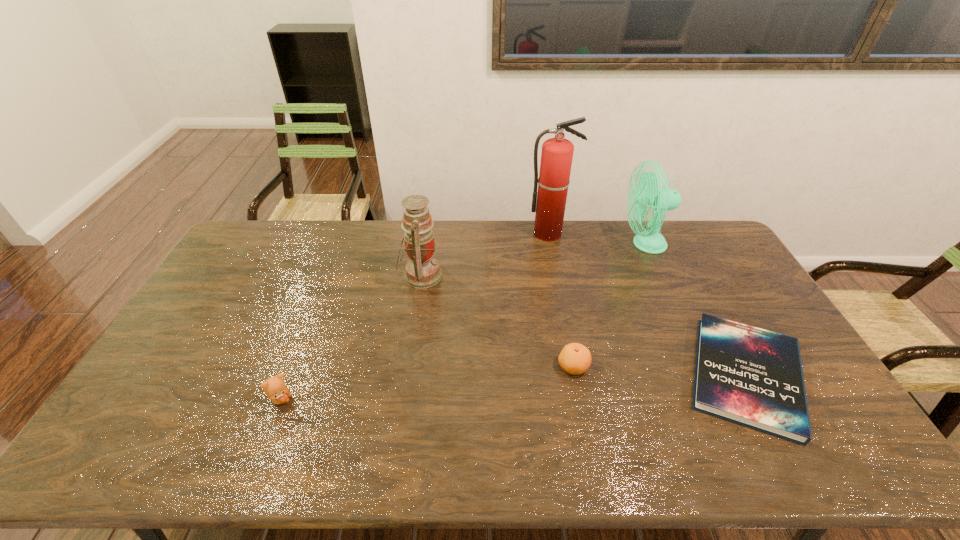
Image resolution: width=960 pixels, height=540 pixels. I want to click on object present at the near right corner, so click(x=750, y=376).

Find the location of a particular element. This screenshot has width=960, height=540. vacant position at the far edge of the desktop is located at coordinates (481, 247).

Image resolution: width=960 pixels, height=540 pixels. In the image, there is a desktop. Find the location of `free space at the near edge`. free space at the near edge is located at coordinates (276, 464).

Where is `free space at the left edge of the desktop`? This screenshot has width=960, height=540. free space at the left edge of the desktop is located at coordinates (173, 401).

At what (x,y) coordinates should I click in order to perform the action: click on vacant space at the far left corner. Please return your answer as a coordinate pair (x, y). The width and height of the screenshot is (960, 540). Looking at the image, I should click on (256, 222).

The height and width of the screenshot is (540, 960). Identify the location of free region at the far right corner. (709, 247).

Locate an element on the screen. The width and height of the screenshot is (960, 540). vacant space that's between the second object from left to right and the fan is located at coordinates (533, 260).

Identify the location of free space between the clementine and the teddy bear. This screenshot has height=540, width=960. [x=427, y=383].

Where is `free space between the hardback book and the leftmost object`? This screenshot has height=540, width=960. free space between the hardback book and the leftmost object is located at coordinates (514, 387).

Locate an element on the screen. The image size is (960, 540). free point between the oil lamp and the fan is located at coordinates (533, 260).